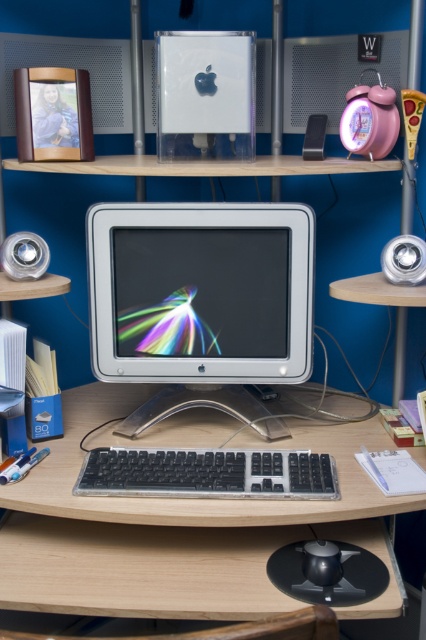
Looking at this image, is clear wood computer desk at center positioned at the back of metallic silver speaker at upper center?

No, clear wood computer desk at center is closer to the viewer.

Between point (115, 400) and point (324, 131), which one is positioned behind?

The point (115, 400) is more distant.

Image resolution: width=426 pixels, height=640 pixels. I want to click on clear wood computer desk at center, so click(180, 529).

Is clear wood computer desk at center to the right of black plastic keyboard at center from the viewer's perspective?

Yes, clear wood computer desk at center is to the right of black plastic keyboard at center.

Describe the element at coordinates (180, 529) in the screenshot. The image size is (426, 640). I see `clear wood computer desk at center` at that location.

Locate an element on the screen. The width and height of the screenshot is (426, 640). clear wood computer desk at center is located at coordinates (180, 529).

You are a GUI agent. You are given a task and a screenshot of the screen. Output one action in this format:
    pyautogui.click(x=<x>, y=<y>)
    Task: Click on the clear wood computer desk at center
    
    Given the screenshot: What is the action you would take?
    pyautogui.click(x=180, y=529)

Based on the photo, is wooden table at right to the left of black plastic mouse at lower center from the viewer's perspective?

No, wooden table at right is not to the left of black plastic mouse at lower center.

Between point (402, 369) and point (324, 566), which one is positioned behind?

Positioned behind is point (402, 369).

The height and width of the screenshot is (640, 426). Identify the location of wooden table at right. (388, 305).